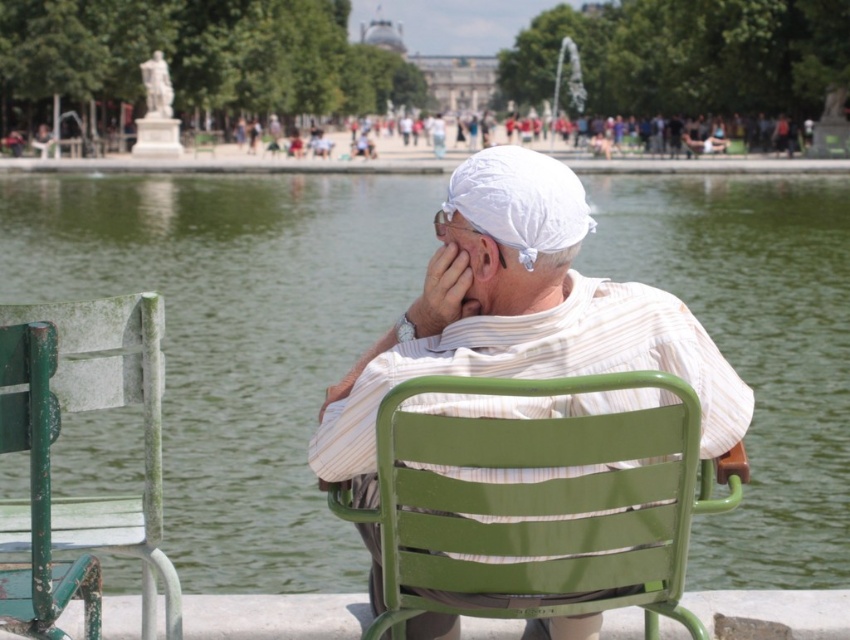
Question: Which point appears closest to the camera in this image?

Choices:
 (A) (x=709, y=353)
 (B) (x=550, y=196)

Answer: (A)

Question: Does green metal lake at center have a smaller size compared to white cotton turban at center?

Choices:
 (A) yes
 (B) no

Answer: (B)

Question: Is white cotton turban at center to the right of white fabric headscarf at center from the viewer's perspective?

Choices:
 (A) yes
 (B) no

Answer: (A)

Question: Among these objects, which one is nearest to the camera?

Choices:
 (A) green metal lake at center
 (B) white cotton turban at center
 (C) white fabric headscarf at center
 (D) green weathered wood chair at left

Answer: (B)

Question: Can you confirm if white cotton turban at center is positioned to the right of white fabric headscarf at center?

Choices:
 (A) no
 (B) yes

Answer: (B)

Question: Which object appears farthest from the camera in this image?

Choices:
 (A) green metal lake at center
 (B) white fabric headscarf at center
 (C) white cotton turban at center

Answer: (A)